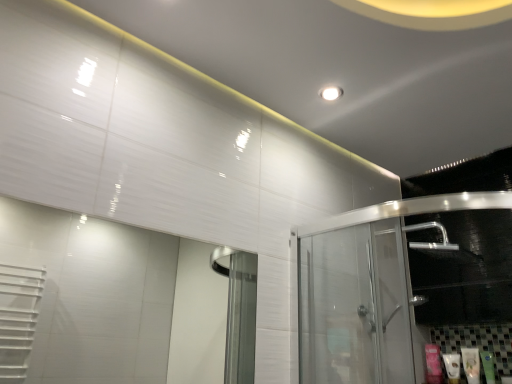
Question: Which is correct: pink matte tube at lower right, the fourth toiletry viewed from the right, is inside white glossy lotion at lower right, marked as the third toiletry in a right-to-left arrangement, or outside of it?

Choices:
 (A) outside
 (B) inside

Answer: (A)

Question: From the image's perspective, relative to white glossy lotion at lower right, marked as the third toiletry in a right-to-left arrangement, is pink matte tube at lower right, acting as the first toiletry starting from the left, above or below?

Choices:
 (A) above
 (B) below

Answer: (B)

Question: Estimate the real-world distances between objects in this image. Which object is farther from the white glossy lotion at lower right, which ranks as the 2th toiletry in left-to-right order?

Choices:
 (A) transparent glass door at right
 (B) pink matte tube at lower right, acting as the first toiletry starting from the left
 (C) white glossy lotion at lower right, which ranks as the 2th toiletry in right-to-left order
 (D) green matte tube at lower right, acting as the first toiletry starting from the right

Answer: (A)

Question: Considering the real-world distances, which object is farthest from the pink matte tube at lower right, acting as the first toiletry starting from the left?

Choices:
 (A) transparent glass door at right
 (B) white glossy lotion at lower right, which is counted as the third toiletry, starting from the left
 (C) white glossy lotion at lower right, which ranks as the 2th toiletry in left-to-right order
 (D) green matte tube at lower right, acting as the first toiletry starting from the right

Answer: (A)